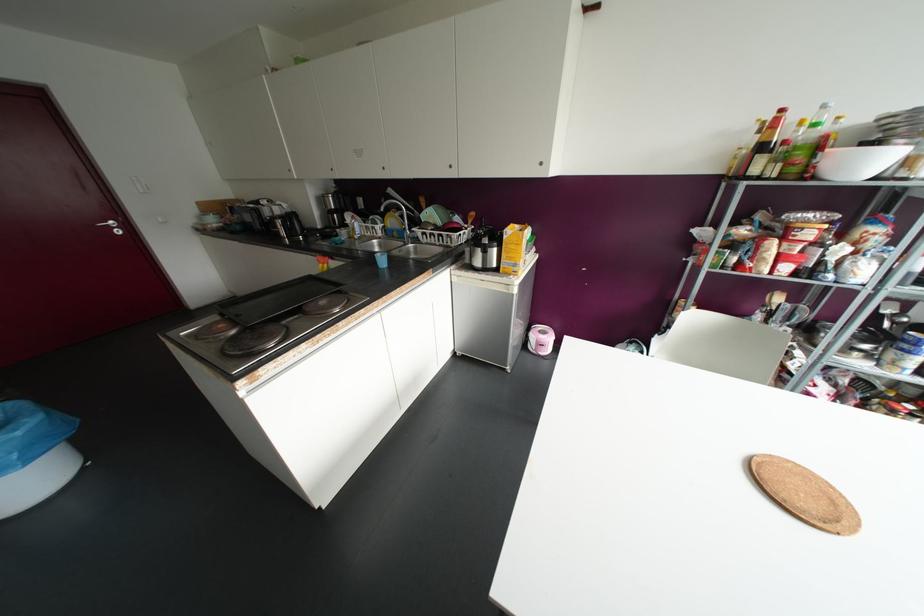
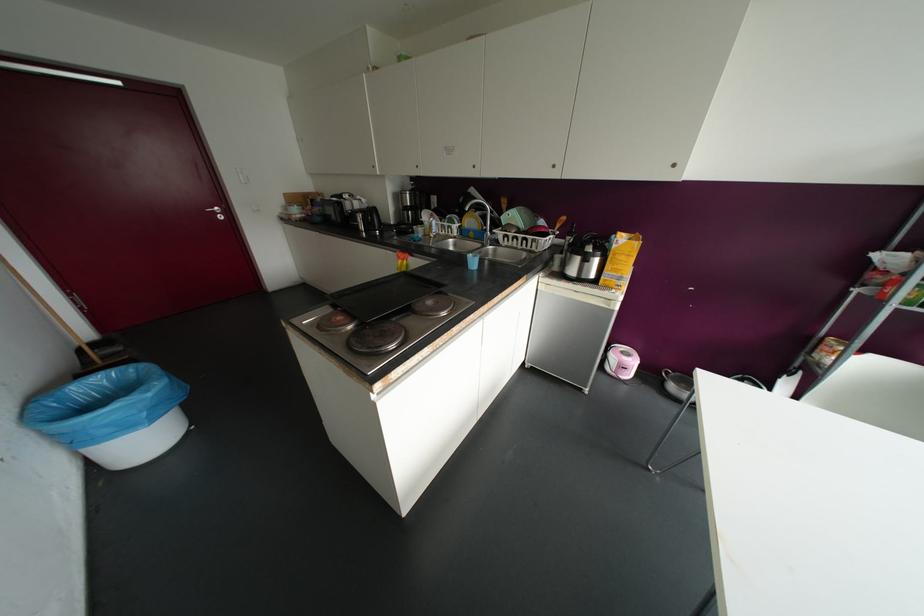
The point at (392,221) is marked in the first image. Where is the corresponding point in the second image?

(469, 221)